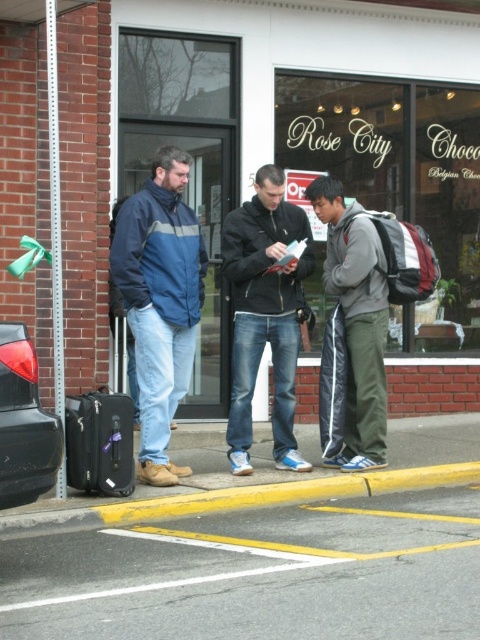
Question: Which object is closer to the camera taking this photo?

Choices:
 (A) yellow asphalt at lower center
 (B) yellow painted curb at lower center
 (C) black matte suitcase at lower left

Answer: (A)

Question: Can you confirm if dark blue jeans at center is positioned to the left of yellow painted curb at lower center?

Choices:
 (A) no
 (B) yes

Answer: (A)

Question: Which object is the farthest from the matte black storefront at center?

Choices:
 (A) dark blue jeans at center
 (B) blue denim jacket at left
 (C) black matte suitcase at lower left

Answer: (C)

Question: Which of these objects is positioned farthest from the yellow painted curb at lower center?

Choices:
 (A) yellow asphalt at lower center
 (B) black matte suitcase at lower left
 (C) gray fleece jacket at center
 (D) matte black storefront at center

Answer: (D)

Question: Can you confirm if blue denim jacket at left is positioned to the left of gray fleece jacket at center?

Choices:
 (A) yes
 (B) no

Answer: (A)

Question: Can you confirm if dark blue jeans at center is positioned above black matte suitcase at lower left?

Choices:
 (A) no
 (B) yes

Answer: (B)